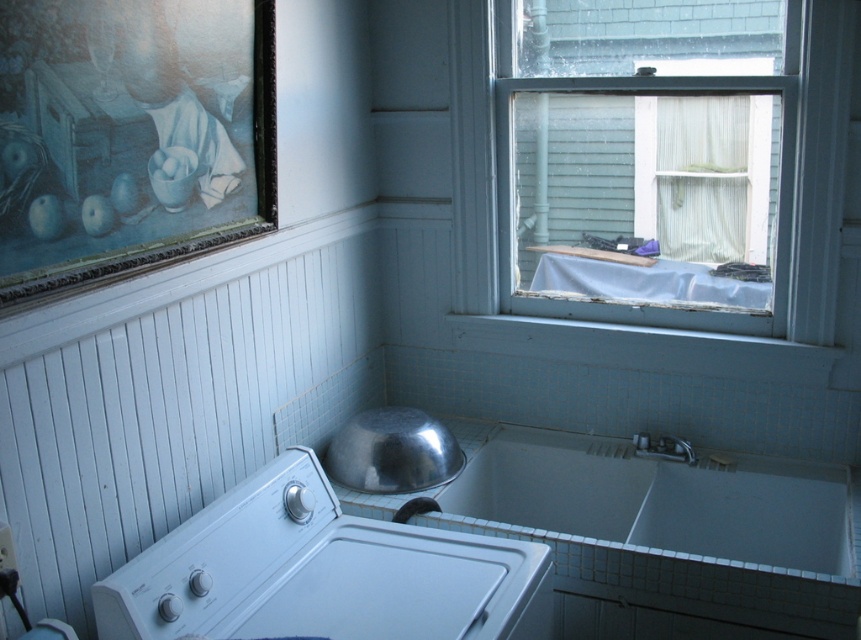
Question: Which point appears closest to the camera in this image?

Choices:
 (A) [x=602, y=106]
 (B) [x=221, y=513]

Answer: (B)

Question: Does clear glass window at upper right appear over white plastic washer at lower left?

Choices:
 (A) yes
 (B) no

Answer: (A)

Question: Where is clear glass window at upper right located in relation to white plastic washer at lower left in the image?

Choices:
 (A) left
 (B) right

Answer: (B)

Question: Is clear glass window at upper right below white plastic washer at lower left?

Choices:
 (A) no
 (B) yes

Answer: (A)